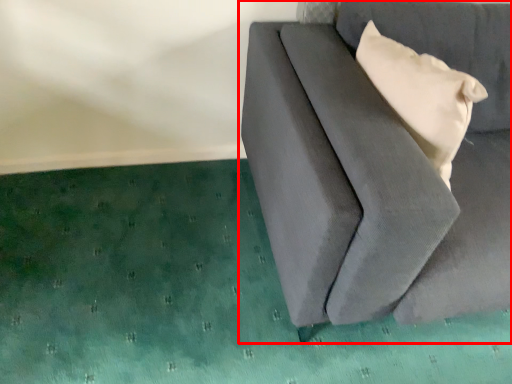
Question: From the image's perspective, what is the correct spatial positioning of furniture (annotated by the red box) in reference to pillow?

Choices:
 (A) below
 (B) above

Answer: (A)